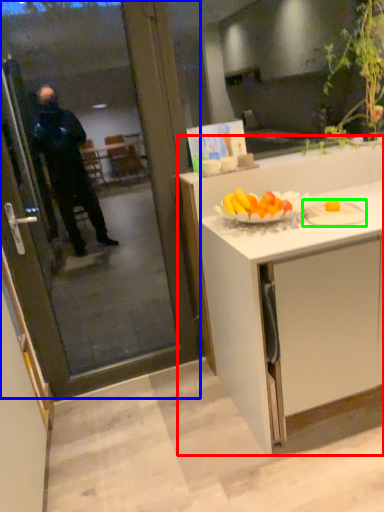
Question: Estimate the real-world distances between objects in this image. Which object is farther from cabinetry (highlighted by a red box), screen door (highlighted by a blue box) or plate (highlighted by a green box)?

Choices:
 (A) screen door
 (B) plate

Answer: (A)